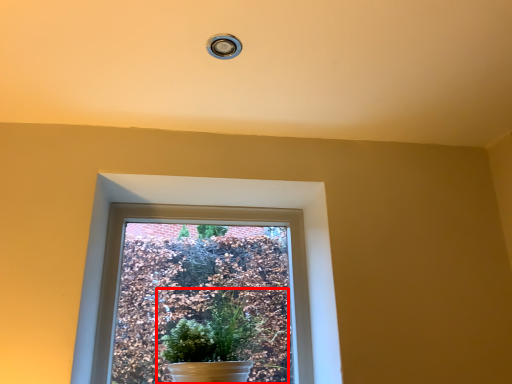
Question: From the image's perspective, what is the correct spatial positioning of houseplant (annotated by the red box) in reference to window?

Choices:
 (A) above
 (B) below

Answer: (B)